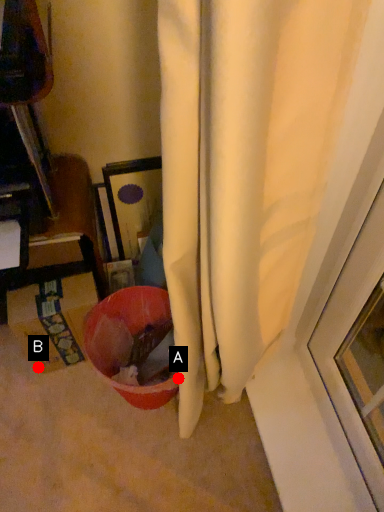
Question: Two points are circled on the image, labeled by A and B beside each circle. Which point appears closest to the camera in this image?

Choices:
 (A) A is closer
 (B) B is closer

Answer: (A)